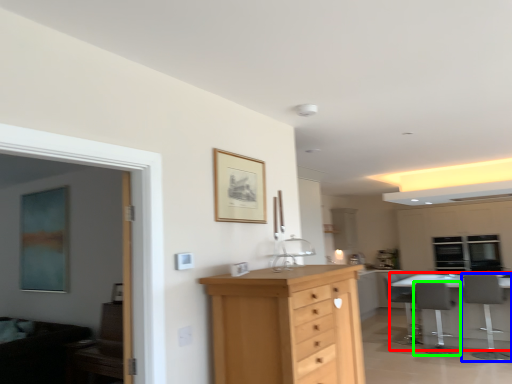
Question: Which object is positioned closest to table (highlighted by a red box)? Select from chair (highlighted by a blue box) and chair (highlighted by a green box).

Choices:
 (A) chair
 (B) chair

Answer: (A)